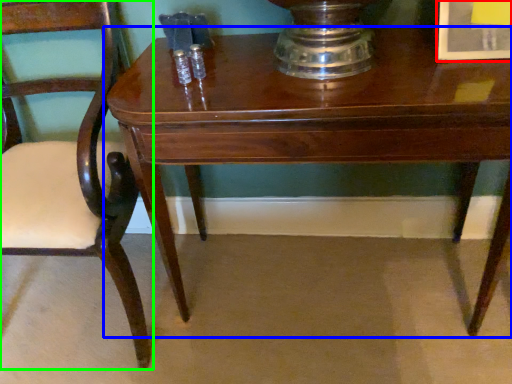
Question: Based on their relative distances, which object is farther from picture frame (highlighted by a red box)? Choose from table (highlighted by a blue box) and chair (highlighted by a green box).

Choices:
 (A) table
 (B) chair

Answer: (B)